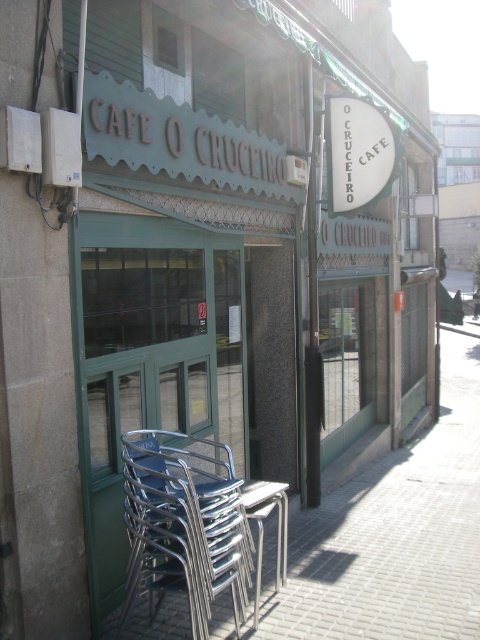
You are standing in front of the cafe and want to place a new bench between the two points, point (x=422, y=600) and point (x=132, y=460). Which point should the bench be closer to in order to be closer to the entrance?

The bench should be closer to point (x=132, y=460) because it is closer to the entrance than point (x=422, y=600), which is further away.

You are a delivery person with a cart that is 1.2 meters wide. You need to move the metallic silver chair at lower left to the back of the cafe. Can you pass between the metallic silver pavement at lower left and the nearest obstacle without tilting the cart?

The metallic silver pavement at lower left is 1.07 meters from the metallic silver chair at lower left. Since the distance between them is less than the cart width of 1.2 meters, the cart cannot pass through without tilting.